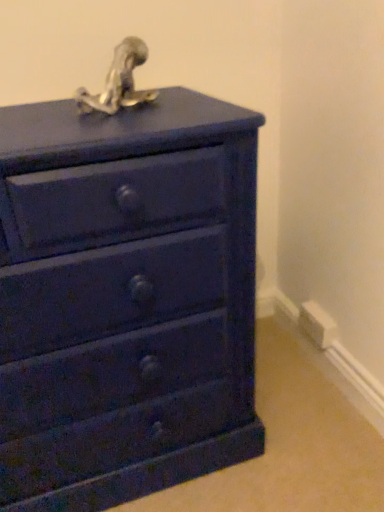
Where is `free space in front of metallic silver sculpture at top`? This screenshot has width=384, height=512. free space in front of metallic silver sculpture at top is located at coordinates (105, 125).